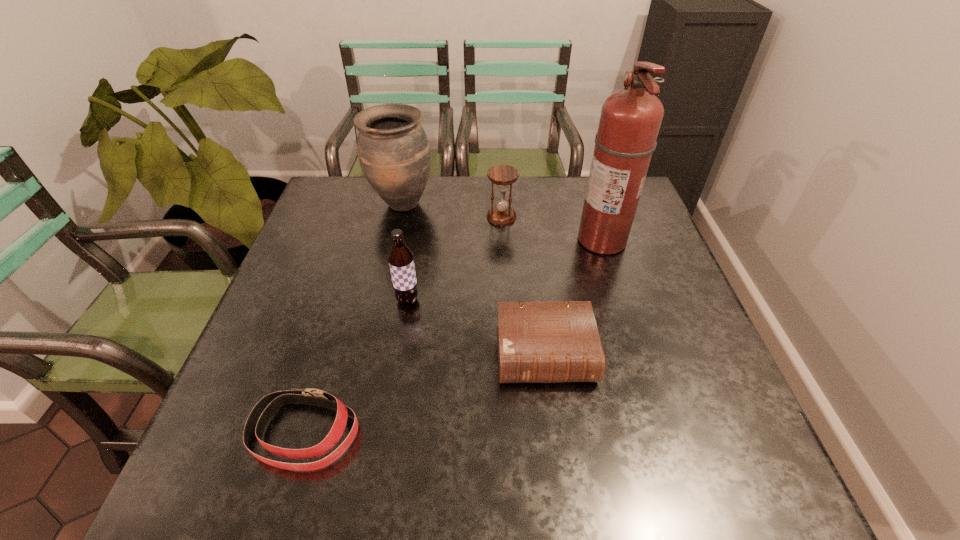
Identify the location of the tallest object. The width and height of the screenshot is (960, 540). (630, 120).

Identify the location of the rightmost object. This screenshot has width=960, height=540. (630, 120).

What are the coordinates of `urn` in the screenshot? It's located at (394, 154).

Where is `the fourth shortest object`? the fourth shortest object is located at coordinates (401, 259).

The image size is (960, 540). Identify the location of the fourth farthest object. (401, 259).

Where is `hourglass`? This screenshot has height=540, width=960. hourglass is located at coordinates (501, 214).

Where is `the fifth farthest object`? the fifth farthest object is located at coordinates (557, 341).

Where is `Bible`? Bible is located at coordinates (557, 341).

This screenshot has width=960, height=540. Identify the location of the shortest object. (263, 411).

Where is `the nearest object`? the nearest object is located at coordinates (263, 411).